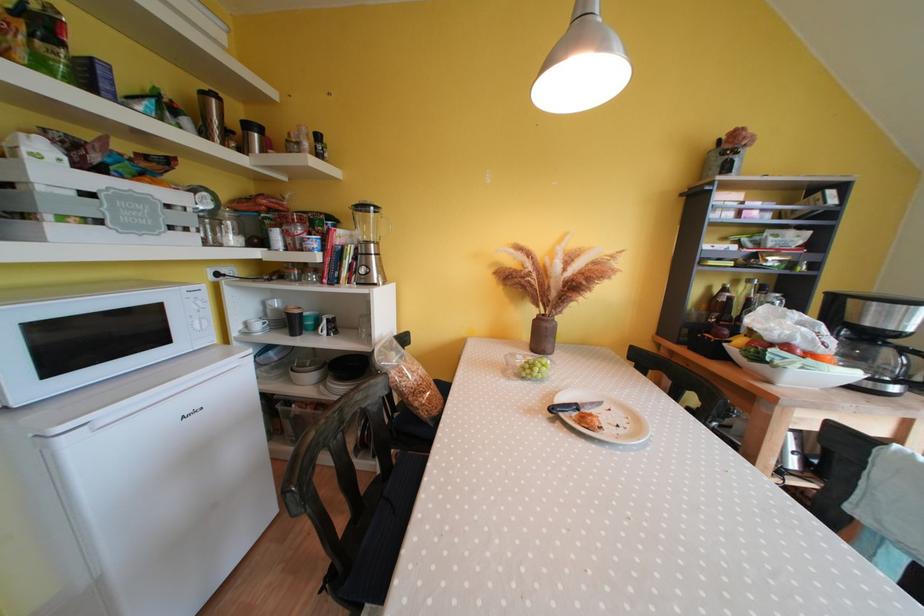
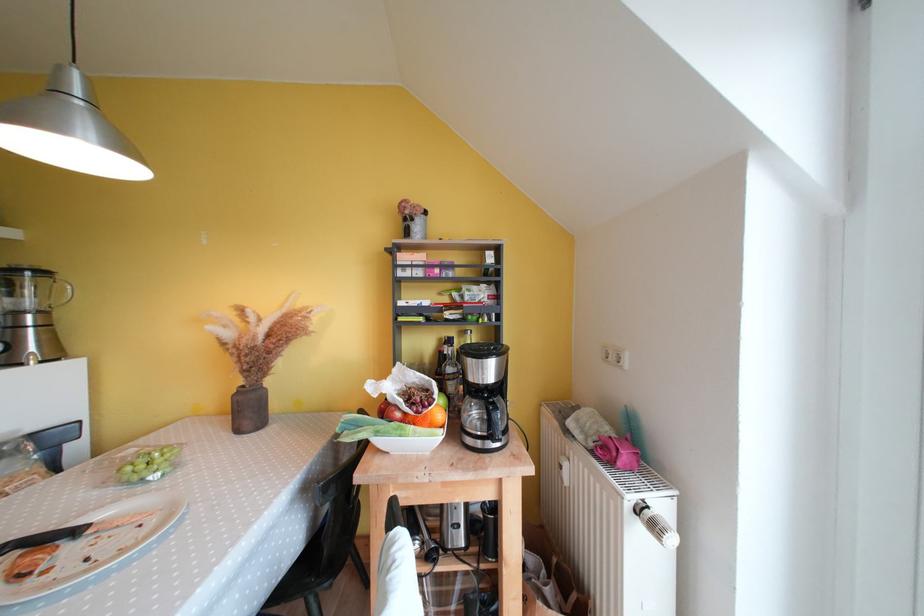
Question: I am providing you with two images of the same scene from different viewpoints. Please identify which objects are invisible in image2.

Choices:
 (A) white ceramic bowl
 (B) coffee maker lid
 (C) black handled knife
 (D) none of these

Answer: (D)